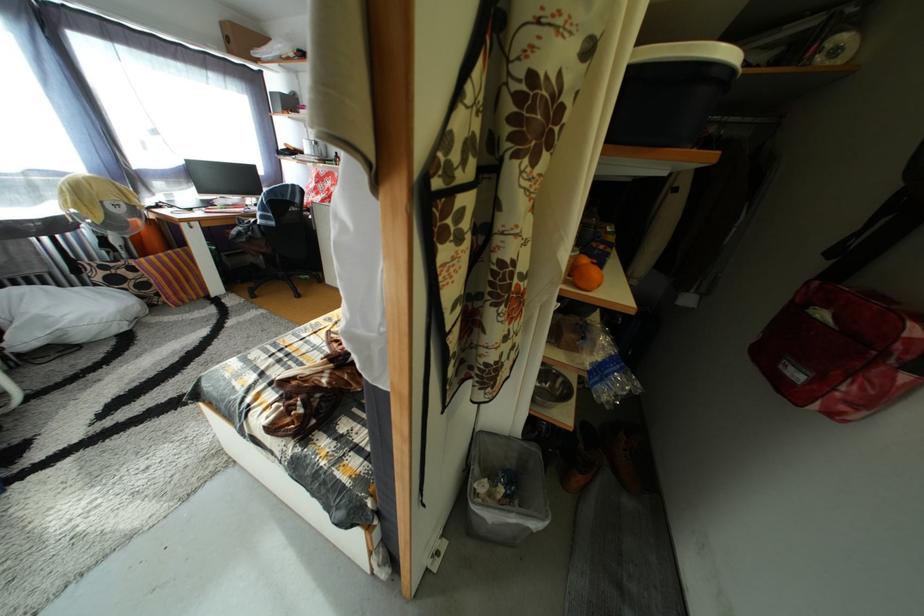
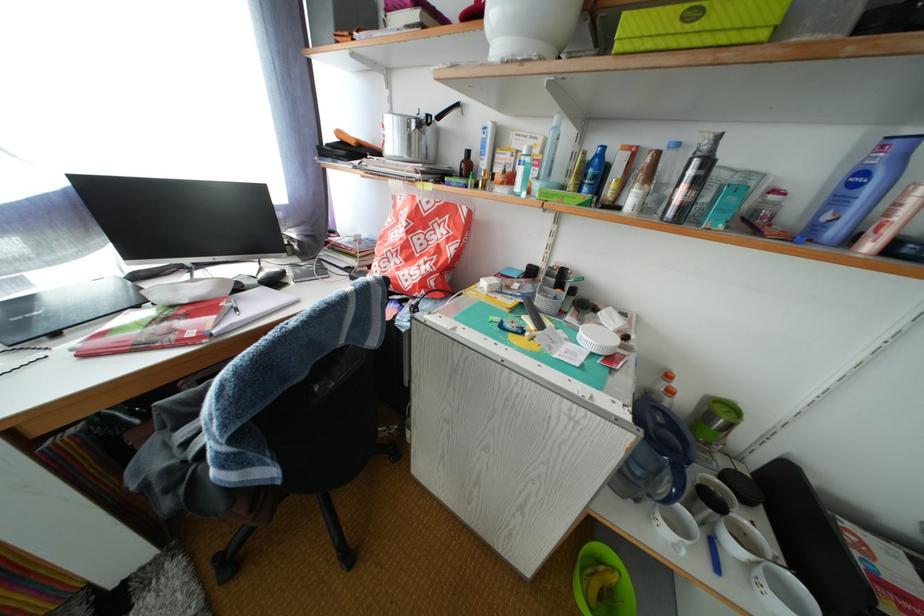
What movement of the cameraman would produce the second image?

The cameraman moved toward left, forward.